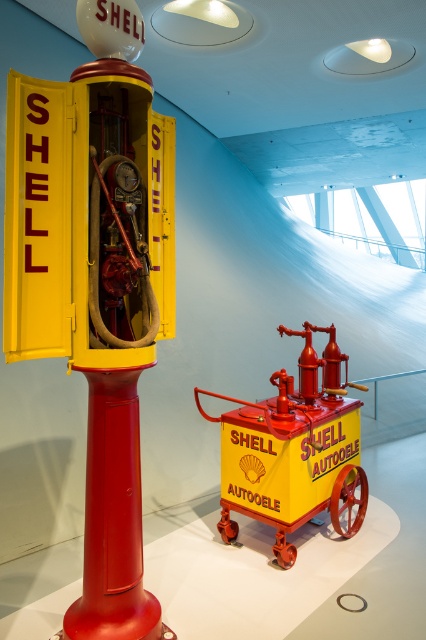
Question: Is metallic yellow fire truck at center positioned before matte yellow cart at center?

Choices:
 (A) yes
 (B) no

Answer: (A)

Question: Is metallic yellow fire truck at center positioned behind matte yellow cart at center?

Choices:
 (A) no
 (B) yes

Answer: (A)

Question: Does metallic yellow fire truck at center appear on the left side of matte yellow cart at center?

Choices:
 (A) yes
 (B) no

Answer: (A)